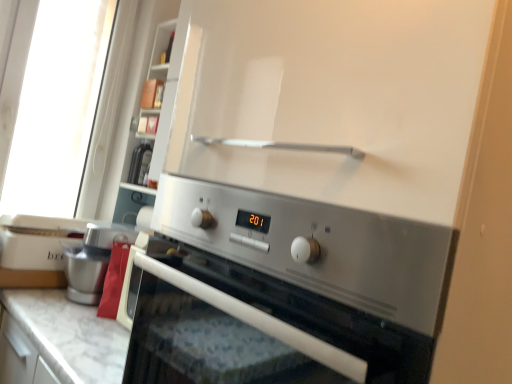
Question: From the image's perspective, is satin silver oven at center positioned above or below white plastic toaster at left?

Choices:
 (A) above
 (B) below

Answer: (B)

Question: Is satin silver oven at center in front of or behind white plastic toaster at left in the image?

Choices:
 (A) front
 (B) behind

Answer: (A)

Question: Based on their relative distances, which object is farther from the white plastic toaster at left?

Choices:
 (A) white marble countertop at lower center
 (B) satin silver oven at center
 (C) metallic silver coffee machine at left

Answer: (B)

Question: Which object is the farthest from the metallic silver coffee machine at left?

Choices:
 (A) white marble countertop at lower center
 (B) satin silver oven at center
 (C) white plastic toaster at left

Answer: (B)